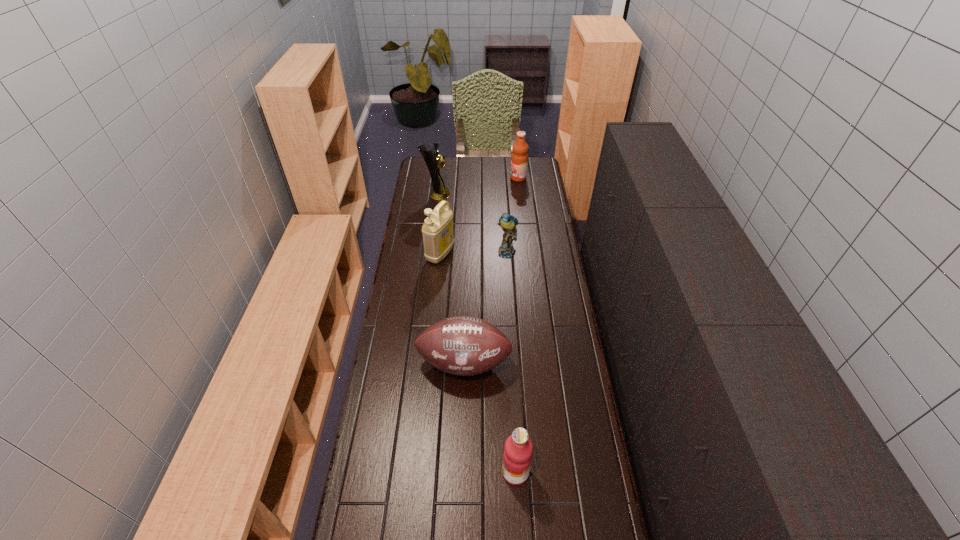
Identify the location of detergent present at the left edge. (438, 237).

Locate an element on the screen. Image resolution: width=960 pixels, height=540 pixels. football (American) that is at the left edge is located at coordinates (462, 345).

You are a GUI agent. You are given a task and a screenshot of the screen. Output one action in this format:
    pyautogui.click(x=<x>, y=<y>)
    Task: Click on the object at the right edge
    The height and width of the screenshot is (540, 960).
    Given the screenshot: What is the action you would take?
    pyautogui.click(x=519, y=159)

What are the coordinates of `object located at the far right corner` in the screenshot? It's located at (519, 159).

Image resolution: width=960 pixels, height=540 pixels. What are the coordinates of `blank space at the left edge of the desktop` in the screenshot? It's located at (391, 409).

In order to click on free space at the right edge in this screenshot , I will do click(x=548, y=264).

The width and height of the screenshot is (960, 540). I want to click on vacant space that's between the detergent and the farthest object, so click(x=479, y=216).

In order to click on vacant space that's between the football (American) and the detergent in this screenshot , I will do `click(452, 309)`.

This screenshot has height=540, width=960. Find the location of `vacant space in between the fifth nearest object and the football (American)`. vacant space in between the fifth nearest object and the football (American) is located at coordinates (450, 279).

This screenshot has height=540, width=960. I want to click on unoccupied area between the detergent and the parrot, so click(x=473, y=253).